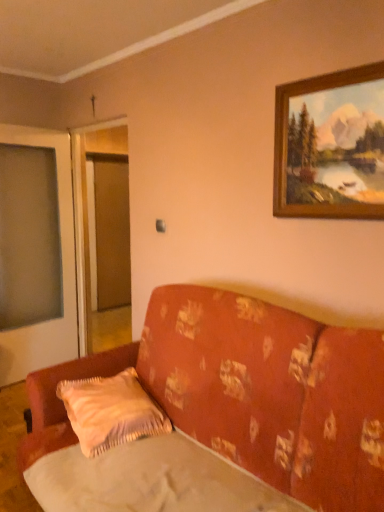
Question: Is silky beige sheet at lower center to the left of floral fabric couch at center from the viewer's perspective?

Choices:
 (A) yes
 (B) no

Answer: (A)

Question: Can you confirm if silky beige sheet at lower center is wider than floral fabric couch at center?

Choices:
 (A) no
 (B) yes

Answer: (A)

Question: Is silky beige sheet at lower center not near floral fabric couch at center?

Choices:
 (A) yes
 (B) no

Answer: (B)

Question: Can you confirm if silky beige sheet at lower center is shorter than floral fabric couch at center?

Choices:
 (A) yes
 (B) no

Answer: (A)

Question: Considering the relative sizes of silky beige sheet at lower center and floral fabric couch at center in the image provided, is silky beige sheet at lower center bigger than floral fabric couch at center?

Choices:
 (A) no
 (B) yes

Answer: (A)

Question: From the image's perspective, is silky beige sheet at lower center located above floral fabric couch at center?

Choices:
 (A) no
 (B) yes

Answer: (A)

Question: Does transparent glass screen door at left have a larger size compared to silky beige sheet at lower center?

Choices:
 (A) no
 (B) yes

Answer: (B)

Question: Does transparent glass screen door at left have a greater height compared to silky beige sheet at lower center?

Choices:
 (A) yes
 (B) no

Answer: (A)

Question: Is silky beige sheet at lower center surrounded by transparent glass screen door at left?

Choices:
 (A) no
 (B) yes

Answer: (A)

Question: Is transparent glass screen door at left facing away from silky beige sheet at lower center?

Choices:
 (A) yes
 (B) no

Answer: (B)

Question: Considering the relative sizes of transparent glass screen door at left and silky beige sheet at lower center in the image provided, is transparent glass screen door at left shorter than silky beige sheet at lower center?

Choices:
 (A) yes
 (B) no

Answer: (B)

Question: Is transparent glass screen door at left at the left side of silky beige sheet at lower center?

Choices:
 (A) no
 (B) yes

Answer: (B)

Question: Does fluffy beige pillow at lower center have a lesser width compared to wooden frame at upper right?

Choices:
 (A) yes
 (B) no

Answer: (B)